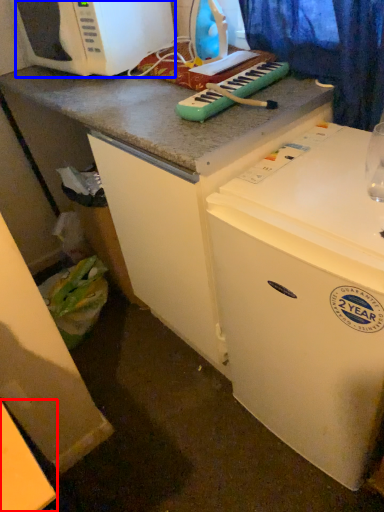
Question: Among these objects, which one is farthest to the camera, counter top (highlighted by a red box) or microwave oven (highlighted by a blue box)?

Choices:
 (A) counter top
 (B) microwave oven

Answer: (B)